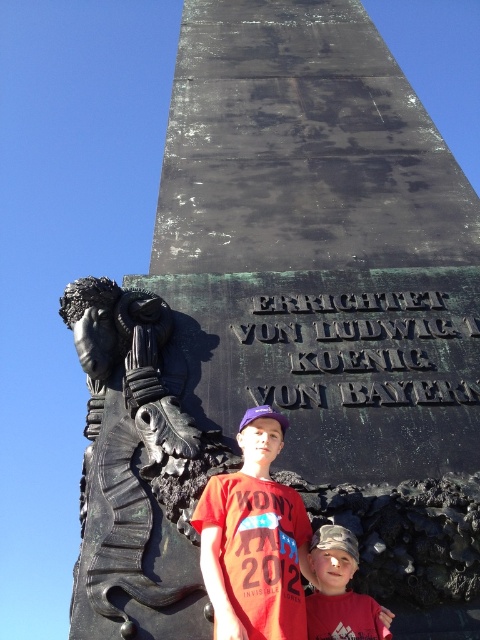
Question: Which object is farther from the camera taking this photo?

Choices:
 (A) matte red shirt at center
 (B) red matte t-shirt at center

Answer: (A)

Question: Does red matte t-shirt at center have a greater width compared to matte red shirt at center?

Choices:
 (A) no
 (B) yes

Answer: (A)

Question: Is red matte t-shirt at center closer to the viewer compared to matte red shirt at center?

Choices:
 (A) no
 (B) yes

Answer: (B)

Question: Can you confirm if red matte t-shirt at center is positioned to the left of matte red shirt at center?

Choices:
 (A) yes
 (B) no

Answer: (A)

Question: Which point is closer to the camera taking this photo?

Choices:
 (A) (237, 472)
 (B) (323, 532)

Answer: (B)

Question: Which point appears farthest from the camera in this image?

Choices:
 (A) (349, 554)
 (B) (215, 604)

Answer: (A)